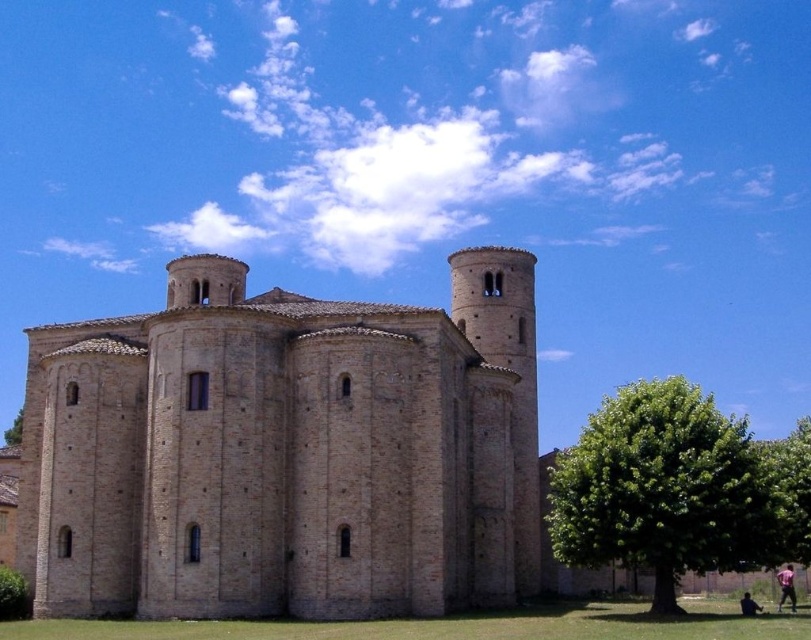
Is green leafy tree at lower right further to the viewer compared to pink fabric pants at lower right?

No.

Is point (582, 509) positioned before point (792, 573)?

Yes, it is in front of point (792, 573).

Does point (659, 593) come behind point (782, 604)?

No, (659, 593) is in front of (782, 604).

At what (x,y) coordinates should I click in order to perform the action: click on green leafy tree at lower right. Please return your answer as a coordinate pair (x, y). Image resolution: width=811 pixels, height=640 pixels. Looking at the image, I should click on (676, 490).

Can you confirm if green leafy tree at lower right is positioned to the right of skinny jeans at lower right?

Correct, you'll find green leafy tree at lower right to the right of skinny jeans at lower right.

Between green leafy tree at lower right and skinny jeans at lower right, which one appears on the left side from the viewer's perspective?

Positioned to the left is skinny jeans at lower right.

Does point (672, 529) come closer to viewer compared to point (751, 611)?

Yes, point (672, 529) is in front of point (751, 611).

Locate an element on the screen. This screenshot has height=640, width=811. green leafy tree at lower right is located at coordinates (676, 490).

Is green leafy tree at lower right further to camera compared to green leafy tree at lower left?

That is False.

Is green leafy tree at lower right to the right of green leafy tree at lower left from the viewer's perspective?

Correct, you'll find green leafy tree at lower right to the right of green leafy tree at lower left.

Does point (796, 488) lie behind point (7, 428)?

No, it is not.

Identify the location of green leafy tree at lower right. (676, 490).